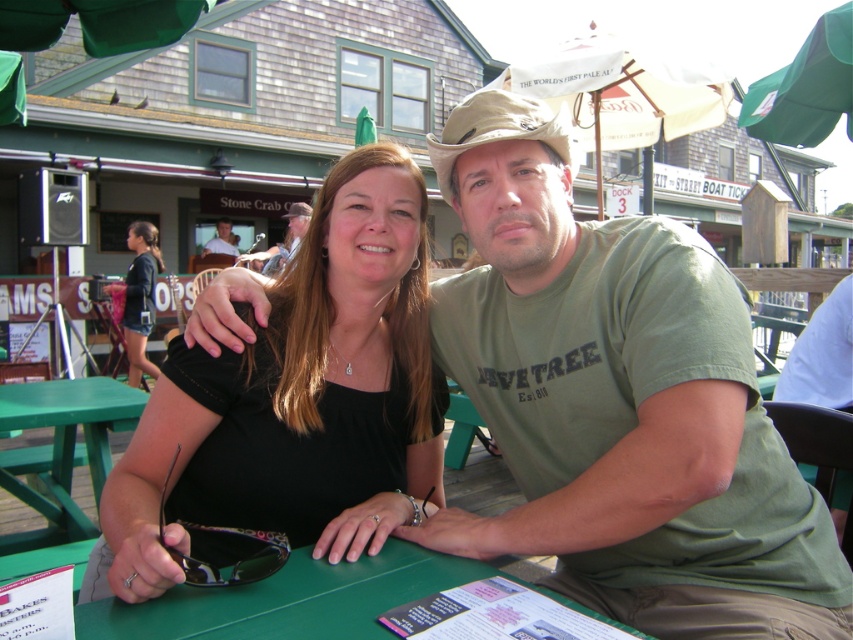
Which is above, green plastic table at center or green painted wood table at lower left?

green plastic table at center is higher up.

Is point (310, 561) closer to camera compared to point (67, 429)?

Yes, point (310, 561) is closer to viewer.

This screenshot has width=853, height=640. In order to click on green plastic table at center in this screenshot , I will do `click(289, 600)`.

Who is positioned more to the left, green cotton shirt at center or green painted wood table at lower left?

green painted wood table at lower left is more to the left.

Measure the distance between point (540, 296) and camera.

The distance of point (540, 296) from camera is 4.97 feet.

Who is more forward, (463, 161) or (7, 467)?

Point (463, 161) is in front.

Locate an element on the screen. green cotton shirt at center is located at coordinates (625, 417).

Does matte khaki hat at upper center have a greater height compared to brown fabric cowboy hat at upper center?

Indeed, matte khaki hat at upper center has a greater height compared to brown fabric cowboy hat at upper center.

You are a GUI agent. You are given a task and a screenshot of the screen. Output one action in this format:
    pyautogui.click(x=<x>, y=<y>)
    Task: Click on the matte khaki hat at upper center
    The image size is (853, 640).
    Given the screenshot: What is the action you would take?
    pyautogui.click(x=289, y=237)

Locate an element on the screen. The height and width of the screenshot is (640, 853). matte khaki hat at upper center is located at coordinates coord(289,237).